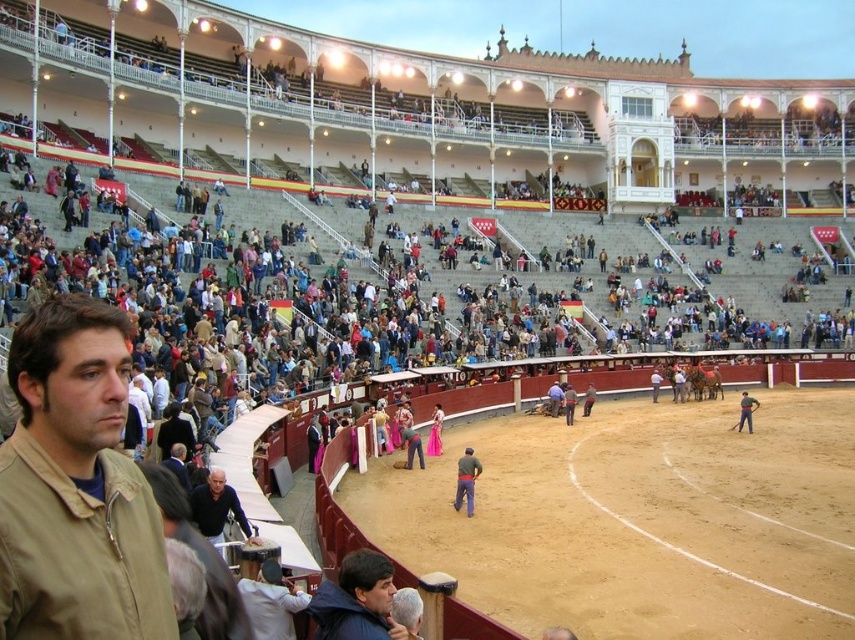
Question: Among these points, which one is nearest to the camera?

Choices:
 (A) (472, 499)
 (B) (323, 595)
 (C) (753, 401)
 (D) (66, 625)

Answer: (D)

Question: Can you confirm if dark gray sweater at lower left is positioned to the right of smooth leather jacket at center?

Choices:
 (A) no
 (B) yes

Answer: (A)

Question: Estimate the real-world distances between objects in this image. Which object is farther from the brown fabric jacket at lower left?

Choices:
 (A) smooth leather jacket at center
 (B) dark blue jacket at lower center

Answer: (A)

Question: Is dark gray sweater at lower left closer to camera compared to smooth leather jacket at center?

Choices:
 (A) yes
 (B) no

Answer: (A)

Question: Can you confirm if dark gray sweater at lower left is thinner than smooth leather jacket at center?

Choices:
 (A) yes
 (B) no

Answer: (A)

Question: Considering the real-world distances, which object is farthest from the brown fabric jacket at lower left?

Choices:
 (A) smooth leather jacket at center
 (B) dark gray sweater at lower left
 (C) dark blue jacket at lower center
 (D) dark blue jeans at center

Answer: (A)